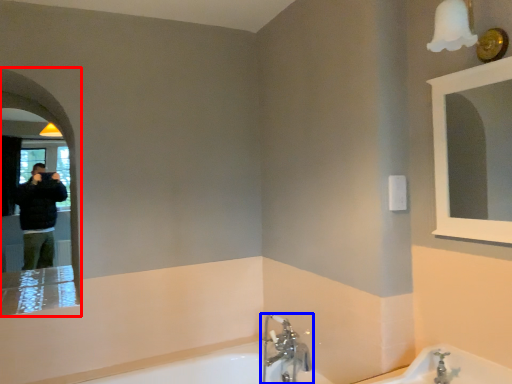
Question: Which object is further to the camera taking this photo, mirror (highlighted by a red box) or tap (highlighted by a blue box)?

Choices:
 (A) mirror
 (B) tap

Answer: (B)